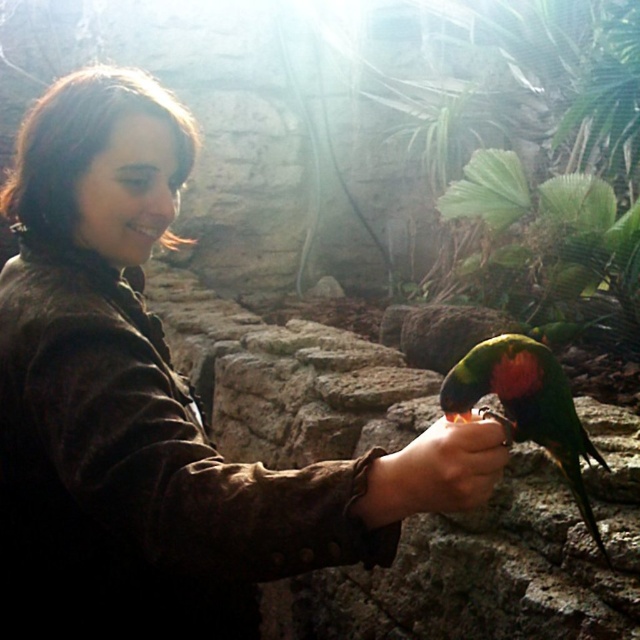
Does brown suede jacket at center appear over brown suede hand at center?

Actually, brown suede jacket at center is below brown suede hand at center.

The width and height of the screenshot is (640, 640). What do you see at coordinates (154, 408) in the screenshot? I see `brown suede jacket at center` at bounding box center [154, 408].

Does point (275, 512) come farther from viewer compared to point (406, 449)?

No, it is not.

Locate an element on the screen. The height and width of the screenshot is (640, 640). brown suede jacket at center is located at coordinates (154, 408).

Can you confirm if multicolored feathered parrot at center is bigger than brown suede hand at center?

Indeed, multicolored feathered parrot at center has a larger size compared to brown suede hand at center.

Does multicolored feathered parrot at center appear on the right side of brown suede hand at center?

Correct, you'll find multicolored feathered parrot at center to the right of brown suede hand at center.

You are a GUI agent. You are given a task and a screenshot of the screen. Output one action in this format:
    pyautogui.click(x=<x>, y=<y>)
    Task: Click on the multicolored feathered parrot at center
    The image size is (640, 640).
    Given the screenshot: What is the action you would take?
    pyautogui.click(x=525, y=404)

Identify the location of multicolored feathered parrot at center. The width and height of the screenshot is (640, 640). (525, 404).

Is brown suede jacket at center shorter than multicolored feathered parrot at center?

No.

Measure the distance between brown suede jacket at center and camera.

brown suede jacket at center and camera are 61.21 centimeters apart from each other.

At what (x,y) coordinates should I click in order to perform the action: click on brown suede jacket at center. Please return your answer as a coordinate pair (x, y). Looking at the image, I should click on (154, 408).